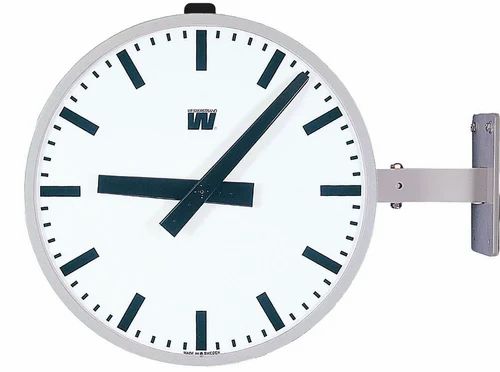
Identify the location of clock. This screenshot has width=500, height=372. (168, 260).